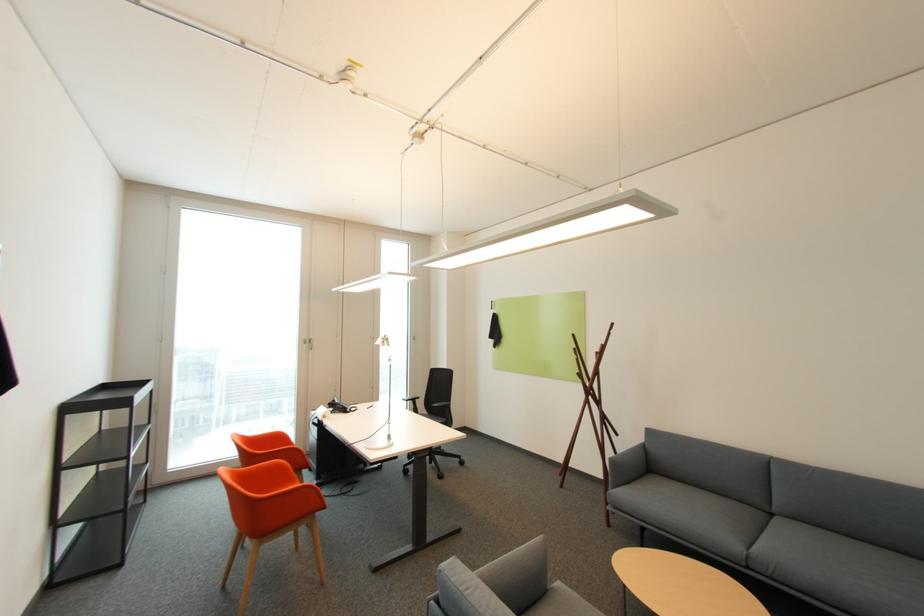
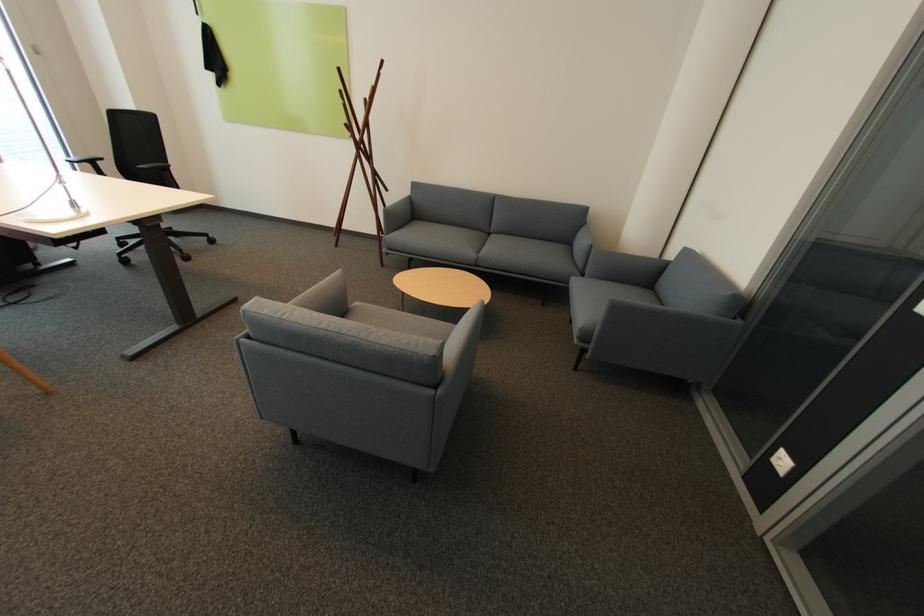
The images are taken continuously from a first-person perspective. In which direction is your viewpoint rotating?

The rotation direction of the camera is right-down.